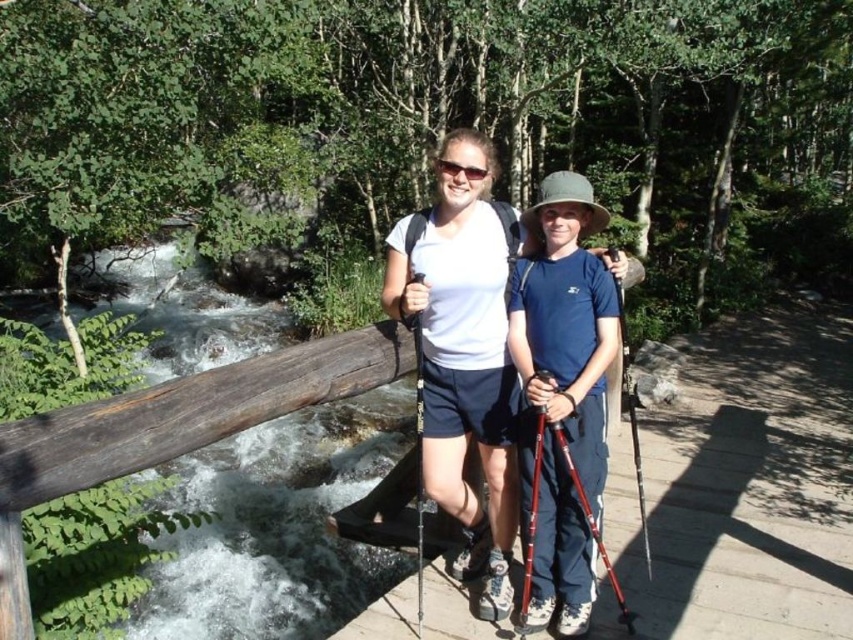
Is white matte shirt at center to the left of matte blue shirt at center from the viewer's perspective?

Yes, white matte shirt at center is to the left of matte blue shirt at center.

Is white matte shirt at center below matte blue shirt at center?

No, white matte shirt at center is not below matte blue shirt at center.

This screenshot has width=853, height=640. What do you see at coordinates (463, 353) in the screenshot?
I see `white matte shirt at center` at bounding box center [463, 353].

Where is `white matte shirt at center`? The width and height of the screenshot is (853, 640). white matte shirt at center is located at coordinates (463, 353).